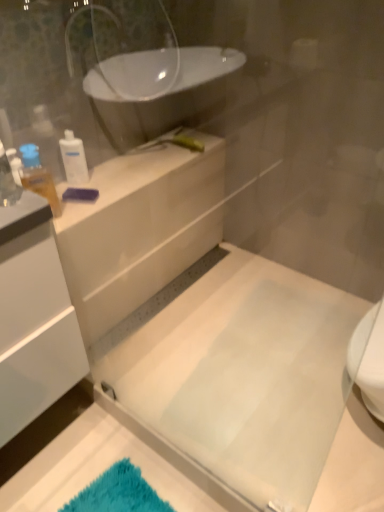
Question: From the image's perspective, is translucent plastic bottle at upper left, which is counted as the 1th toiletry, starting from the front, located beneath white plastic bottle at upper left, which is the 1th toiletry in back-to-front order?

Choices:
 (A) no
 (B) yes

Answer: (B)

Question: Is the position of translucent plastic bottle at upper left, which is counted as the second toiletry, starting from the back, more distant than that of white plastic bottle at upper left, which is the 1th toiletry in back-to-front order?

Choices:
 (A) yes
 (B) no

Answer: (B)

Question: Is translucent plastic bottle at upper left, which is counted as the 1th toiletry, starting from the front, located outside white plastic bottle at upper left, which is the 1th toiletry in back-to-front order?

Choices:
 (A) no
 (B) yes

Answer: (B)

Question: From the image's perspective, is translucent plastic bottle at upper left, which is counted as the 1th toiletry, starting from the front, over white plastic bottle at upper left, which is the 1th toiletry in back-to-front order?

Choices:
 (A) yes
 (B) no

Answer: (B)

Question: Does translucent plastic bottle at upper left, which is counted as the second toiletry, starting from the back, have a greater width compared to white plastic bottle at upper left, which is the 1th toiletry in back-to-front order?

Choices:
 (A) yes
 (B) no

Answer: (A)

Question: Is white glossy counter at upper left bigger or smaller than translucent plastic bottle at upper left, which is counted as the 1th toiletry, starting from the front?

Choices:
 (A) small
 (B) big

Answer: (B)

Question: From a real-world perspective, is white glossy counter at upper left physically located above or below translucent plastic bottle at upper left, which is counted as the second toiletry, starting from the back?

Choices:
 (A) above
 (B) below

Answer: (B)

Question: Relative to translucent plastic bottle at upper left, which is counted as the second toiletry, starting from the back, is white glossy counter at upper left in front or behind?

Choices:
 (A) behind
 (B) front

Answer: (A)

Question: Do you think white glossy counter at upper left is within translucent plastic bottle at upper left, which is counted as the second toiletry, starting from the back, or outside of it?

Choices:
 (A) inside
 (B) outside

Answer: (B)

Question: From the image's perspective, is white glossy counter at upper left positioned above or below white plastic bottle at upper left, which is the 1th toiletry in back-to-front order?

Choices:
 (A) above
 (B) below

Answer: (B)

Question: Considering the positions of white glossy counter at upper left and white plastic bottle at upper left, which is the 1th toiletry in back-to-front order, in the image, is white glossy counter at upper left wider or thinner than white plastic bottle at upper left, which is the 1th toiletry in back-to-front order,?

Choices:
 (A) wide
 (B) thin

Answer: (A)

Question: Relative to white plastic bottle at upper left, which is the 1th toiletry in back-to-front order, is white glossy counter at upper left in front or behind?

Choices:
 (A) front
 (B) behind

Answer: (A)

Question: Considering the positions of white glossy counter at upper left and white plastic bottle at upper left, which is the 1th toiletry in back-to-front order, in the image, is white glossy counter at upper left bigger or smaller than white plastic bottle at upper left, which is the 1th toiletry in back-to-front order,?

Choices:
 (A) big
 (B) small

Answer: (A)

Question: Considering the positions of translucent plastic bottle at upper left, which is counted as the 1th toiletry, starting from the front, and white glossy counter at upper left in the image, is translucent plastic bottle at upper left, which is counted as the 1th toiletry, starting from the front, taller or shorter than white glossy counter at upper left?

Choices:
 (A) short
 (B) tall

Answer: (B)

Question: Does point (23, 183) appear closer or farther from the camera than point (177, 208)?

Choices:
 (A) closer
 (B) farther

Answer: (A)